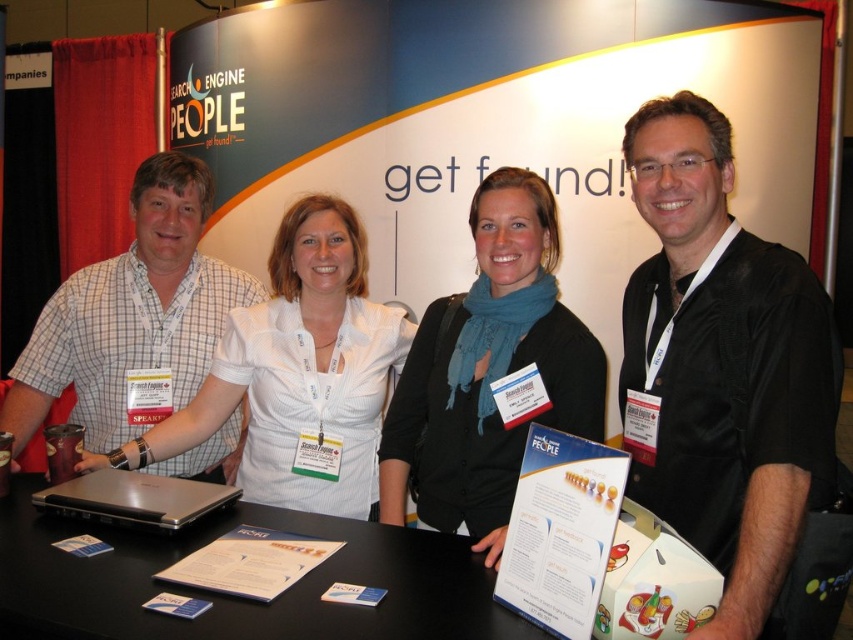
Is white matte shirt at center in front of white checkered shirt at left?

That is True.

Is white matte shirt at center to the left of white checkered shirt at left from the viewer's perspective?

In fact, white matte shirt at center is to the right of white checkered shirt at left.

What do you see at coordinates (297, 371) in the screenshot? I see `white matte shirt at center` at bounding box center [297, 371].

Where is `white matte shirt at center`? This screenshot has width=853, height=640. white matte shirt at center is located at coordinates (297, 371).

How far apart are black satin shirt at center and silver metallic laptop at lower left?

black satin shirt at center is 1.04 meters from silver metallic laptop at lower left.

Find the location of a particular element. Image resolution: width=853 pixels, height=640 pixels. black satin shirt at center is located at coordinates (722, 369).

Does point (641, 168) come farther from viewer compared to point (200, 500)?

No, (641, 168) is closer to viewer.

Where is `black satin shirt at center`? This screenshot has height=640, width=853. black satin shirt at center is located at coordinates (722, 369).

Which is above, black satin shirt at center or white checkered shirt at left?

white checkered shirt at left is above.

Which is behind, point (828, 442) or point (48, 381)?

Positioned behind is point (48, 381).

Find the location of a particular element. black satin shirt at center is located at coordinates (722, 369).